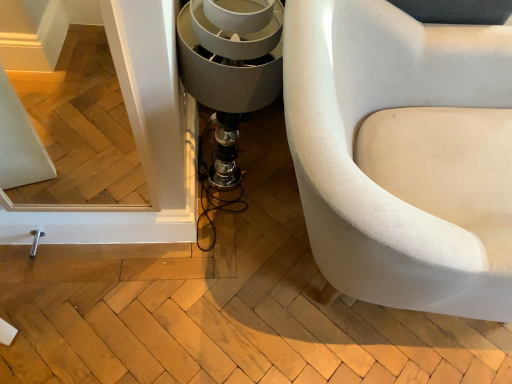
Where is `white fabric chair at right`? This screenshot has height=384, width=512. white fabric chair at right is located at coordinates (362, 173).

Describe the element at coordinates (362, 173) in the screenshot. I see `white fabric chair at right` at that location.

What are the coordinates of `white fabric chair at right` in the screenshot? It's located at (362, 173).